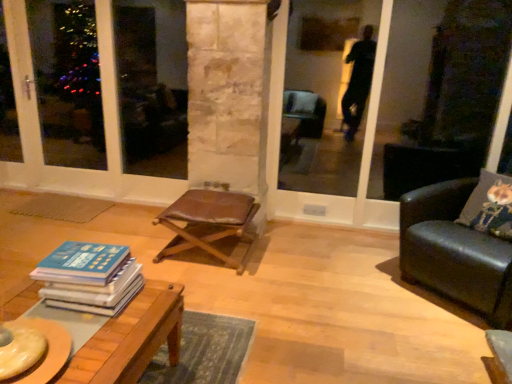
Question: Visually, is black leather couch at right positioned to the left or to the right of transparent glass door at upper center?

Choices:
 (A) left
 (B) right

Answer: (B)

Question: Is black leather couch at right bigger or smaller than transparent glass door at upper center?

Choices:
 (A) big
 (B) small

Answer: (B)

Question: Estimate the real-world distances between objects in this image. Which object is closer to the transparent glass door at upper center?

Choices:
 (A) black leather couch at right
 (B) blue hardcover book at lower left
 (C) white glass screen door at left
 (D) fluffy beige pillow at right
 (E) wooden table at lower left

Answer: (A)

Question: Which is farther from the white glass screen door at left?

Choices:
 (A) blue hardcover book at lower left
 (B) fluffy beige pillow at right
 (C) black leather couch at right
 (D) transparent glass door at upper center
 (E) leather stool at center

Answer: (B)